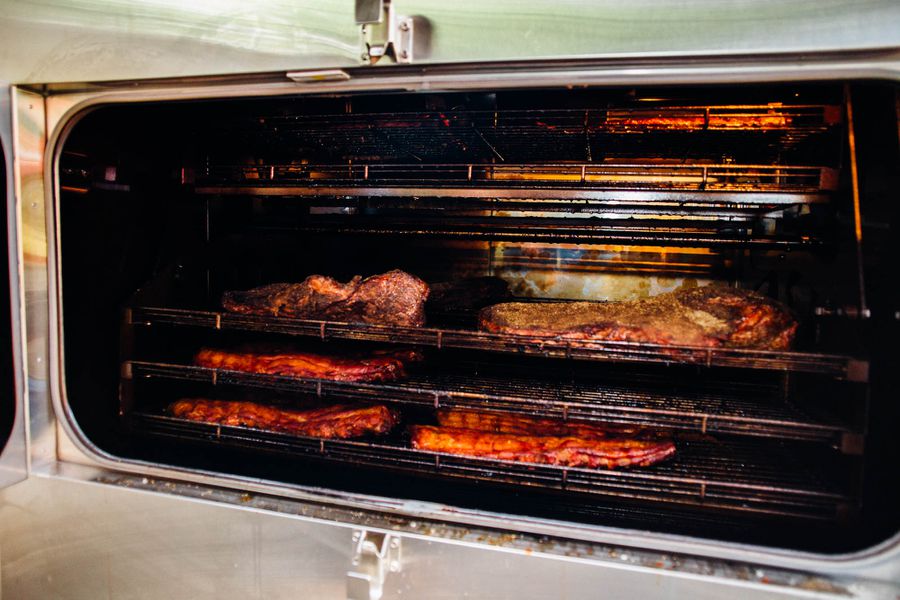
Identify the location of center rack. This screenshot has height=600, width=900. (675, 417).